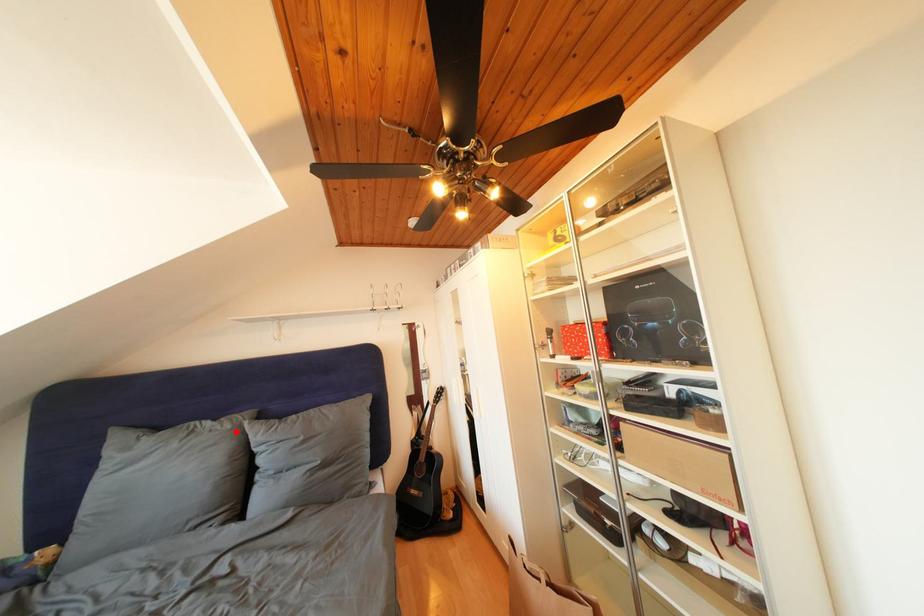
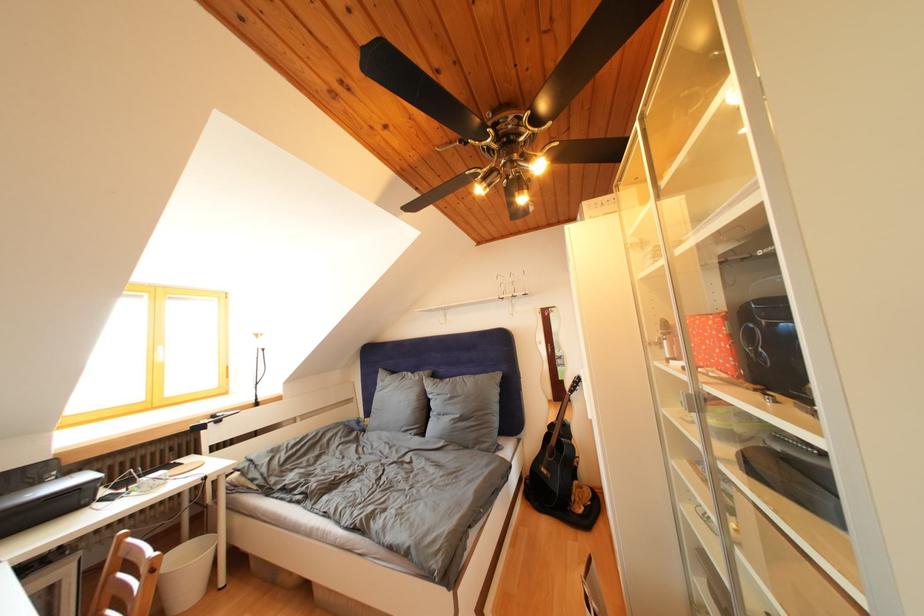
Find the pixel in the second image that matches the highlighted location in the first image.

(426, 383)